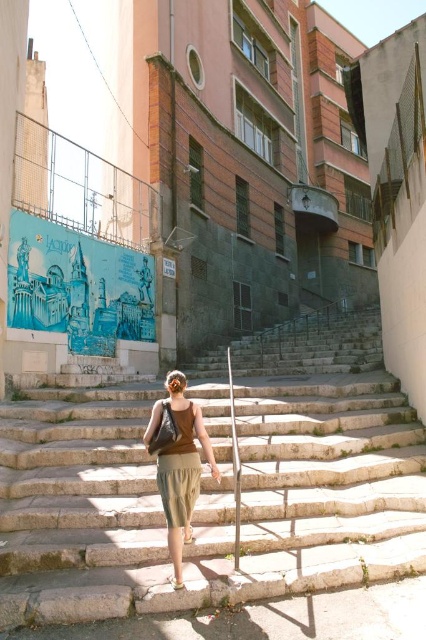
Between point (287, 570) and point (189, 540), which one is positioned behind?

Positioned behind is point (189, 540).

Does stone steps at center have a smaller size compared to beige fabric sandal at lower center?

Incorrect, stone steps at center is not smaller in size than beige fabric sandal at lower center.

Does point (242, 372) come farther from viewer compared to point (184, 525)?

Yes.

The width and height of the screenshot is (426, 640). What are the coordinates of `stone steps at center` in the screenshot? It's located at (215, 484).

Does olive green fabric skirt at center appear on the left side of brown leather sandal at lower center?

No, olive green fabric skirt at center is not to the left of brown leather sandal at lower center.

Does olive green fabric skirt at center have a greater height compared to brown leather sandal at lower center?

Indeed, olive green fabric skirt at center has a greater height compared to brown leather sandal at lower center.

Is point (184, 412) more distant than point (172, 586)?

Yes, it is behind point (172, 586).

This screenshot has height=640, width=426. I want to click on olive green fabric skirt at center, so click(x=181, y=467).

Is point (198, 474) more distant than point (187, 525)?

Yes, it is.

Which is behind, point (160, 492) or point (189, 538)?

The point (189, 538) is more distant.

You are a GUI agent. You are given a task and a screenshot of the screen. Output one action in this format:
    pyautogui.click(x=<x>, y=<y>)
    Task: Click on the olive green fabric skirt at center
    This screenshot has height=640, width=426.
    Given the screenshot: What is the action you would take?
    pyautogui.click(x=181, y=467)